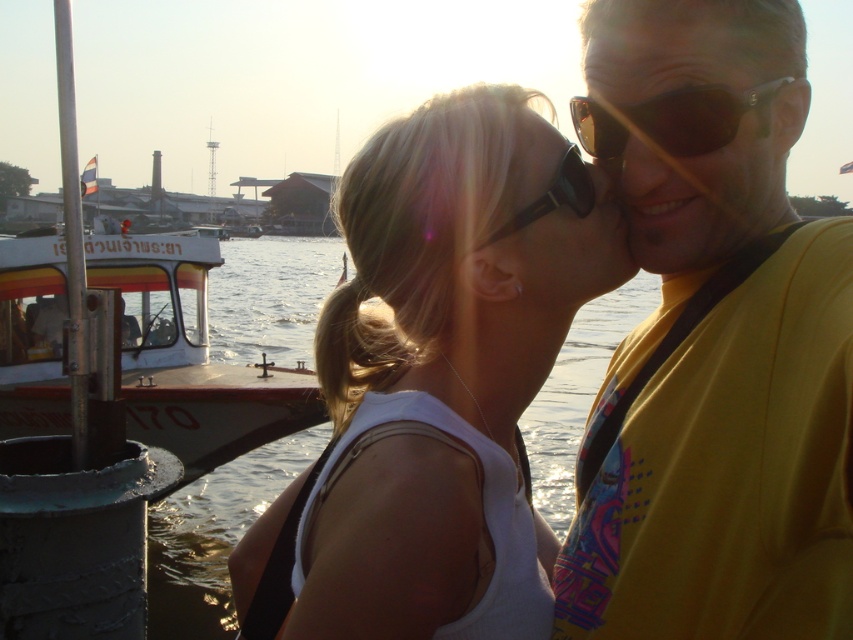
Question: Considering the real-world distances, which object is farthest from the matte yellow shirt at upper right?

Choices:
 (A) sunglasses at upper right
 (B) black plastic sunglasses at center
 (C) white painted wood boat at left
 (D) sunglasses at center

Answer: (C)

Question: Does matte yellow shirt at upper right come behind sunglasses at center?

Choices:
 (A) yes
 (B) no

Answer: (B)

Question: Estimate the real-world distances between objects in this image. Which object is closer to the white matte tank top at center?

Choices:
 (A) yellow fabric shirt at center
 (B) matte skin forehead at upper center

Answer: (A)

Question: Can you confirm if yellow fabric shirt at center is wider than black plastic sunglasses at center?

Choices:
 (A) no
 (B) yes

Answer: (B)

Question: Does matte yellow shirt at upper right have a larger size compared to sunglasses at center?

Choices:
 (A) no
 (B) yes

Answer: (B)

Question: Which of the following is the closest to the observer?

Choices:
 (A) (259, 300)
 (B) (581, 180)
 (C) (672, 204)

Answer: (C)